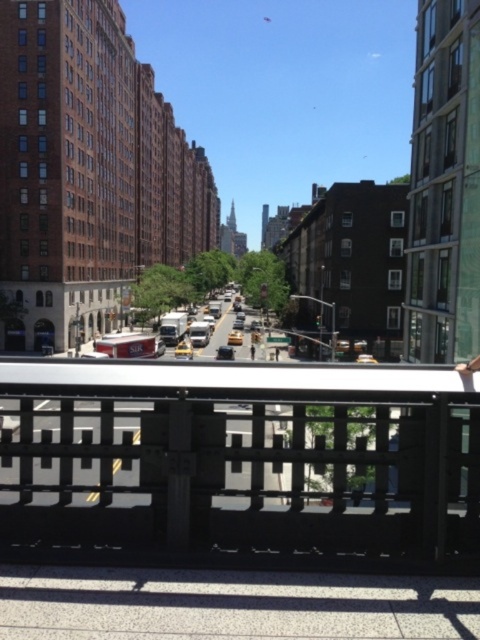
You are standing on a pedestrian bridge and want to walk down to the street below. You notice a black metal fence at lower center and a gray concrete pavement at lower center. Which object is closer to you as you stand on the bridge?

The black metal fence at lower center is closer to you than the gray concrete pavement at lower center because it is further to the viewer.

You are standing on the pedestrian bridge and looking down at the street below. You see the black metal fence at lower center and the gray concrete pavement at lower center. Which object is positioned to the left when viewed from your perspective?

The black metal fence at lower center is to the left of the gray concrete pavement at lower center from your perspective on the pedestrian bridge.

You are standing on the pedestrian bridge and looking down at the street below. You notice two points marked on the road. The first point is at coordinates point (15, 486) and the second is at point (128, 593). From your elevated position, which point appears closer to you?

Point (128, 593) appears closer to you because it is in front of point (15, 486). Since the observer is on the pedestrian bridge, the point that is closer in the foreground would be the one that is in front spatially, which according to the description, point (15, 486) is behind point (128, 593). Therefore, point (128, 593) is closer.